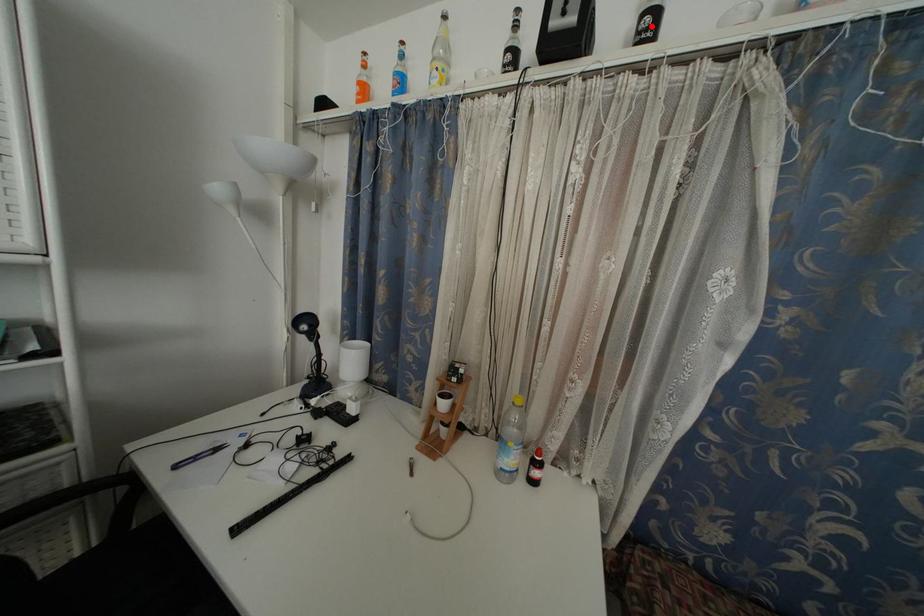
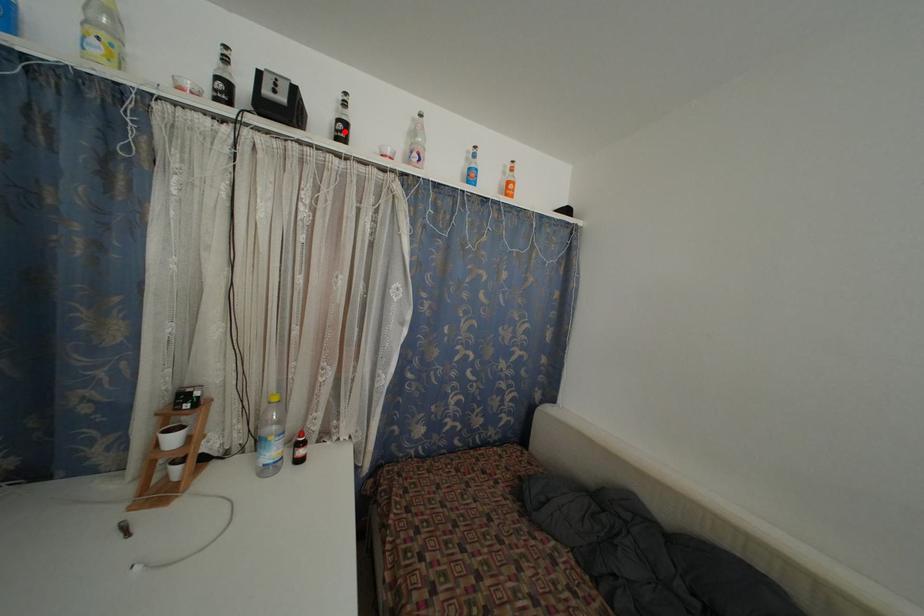
I am providing you with two images of the same scene from different viewpoints. A red point is marked on the first image and another point is marked on the second image. Is the red point in image1 aligned with the point shown in image2?

Yes